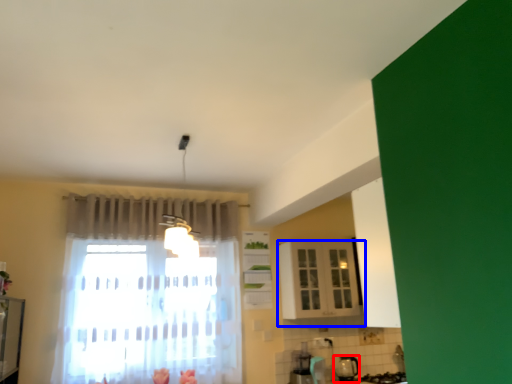
Question: Which object appears closest to the camera in this image, appliance (highlighted by a red box) or cabinetry (highlighted by a blue box)?

Choices:
 (A) appliance
 (B) cabinetry

Answer: (B)